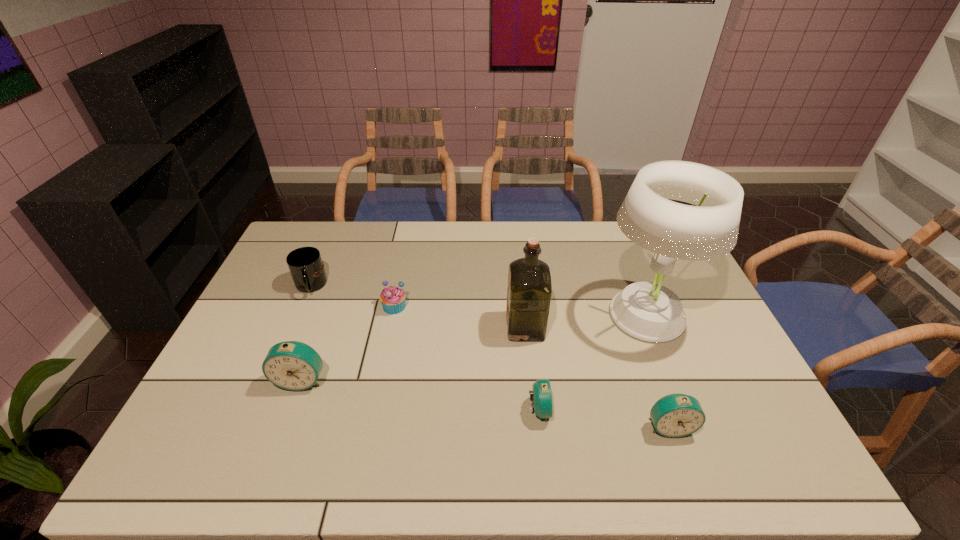
Image resolution: width=960 pixels, height=540 pixels. What are the coordinates of `vacant area between the lamp and the farthest alarm clock` in the screenshot? It's located at (473, 347).

Where is `free space between the shortest alarm clock and the lamp`? Image resolution: width=960 pixels, height=540 pixels. free space between the shortest alarm clock and the lamp is located at coordinates (592, 362).

Locate an element on the screen. This screenshot has height=540, width=960. free space that is in between the farthest alarm clock and the mug is located at coordinates [x=306, y=333].

Find the location of a particular element. vacant area between the tallest object and the rightmost alarm clock is located at coordinates (657, 370).

The image size is (960, 540). I want to click on vacant area that lies between the tallest alarm clock and the tallest object, so click(x=473, y=347).

At what (x,y) coordinates should I click in order to perform the action: click on object that is the fifth closest to the second alarm clock from left to right. Please return your answer as a coordinate pair (x, y). The image size is (960, 540). Looking at the image, I should click on click(x=292, y=365).

Image resolution: width=960 pixels, height=540 pixels. I want to click on object that stands as the sixth closest to the third nearest object, so click(x=676, y=415).

You are a GUI agent. You are given a task and a screenshot of the screen. Output one action in this format:
    pyautogui.click(x=<x>, y=<y>)
    Task: Click on the third closest alarm clock relative to the lamp
    The image size is (960, 540).
    Given the screenshot: What is the action you would take?
    pyautogui.click(x=292, y=365)

The height and width of the screenshot is (540, 960). I want to click on alarm clock that is the second closest to the tallest alarm clock, so click(x=676, y=415).

Where is `vacant space that satisfies the following two spatial constraints: 1. on the front-facing side of the lamp; 2. on the front-facing side of the second shortest alarm clock`? Image resolution: width=960 pixels, height=540 pixels. vacant space that satisfies the following two spatial constraints: 1. on the front-facing side of the lamp; 2. on the front-facing side of the second shortest alarm clock is located at coordinates (688, 426).